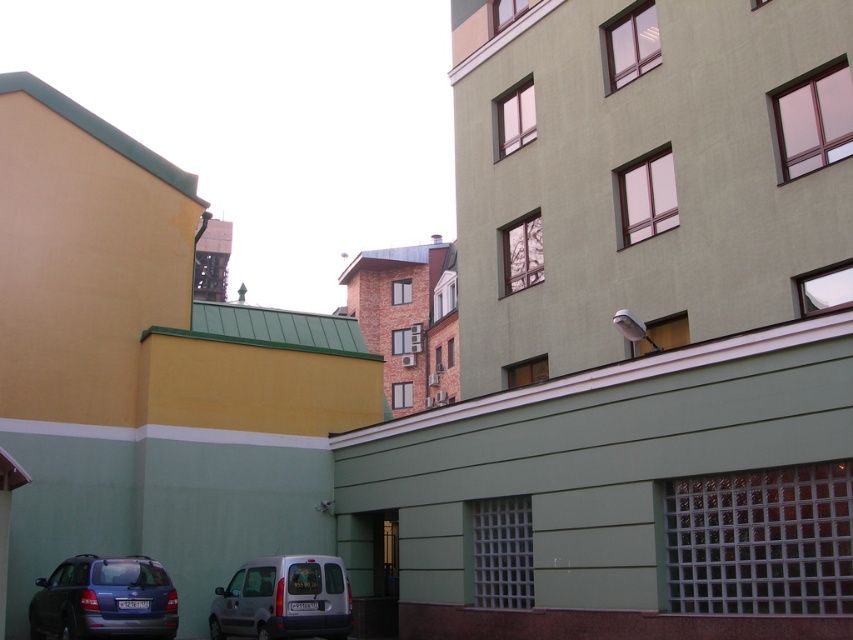
Describe the element at coordinates (103, 600) in the screenshot. I see `matte blue station wagon at lower left` at that location.

From the picture: Can you confirm if matte blue station wagon at lower left is positioned below silver metallic van at lower left?

Actually, matte blue station wagon at lower left is above silver metallic van at lower left.

Is point (135, 609) more distant than point (332, 564)?

No, it is in front of (332, 564).

Image resolution: width=853 pixels, height=640 pixels. Find the location of `matte blue station wagon at lower left`. matte blue station wagon at lower left is located at coordinates (103, 600).